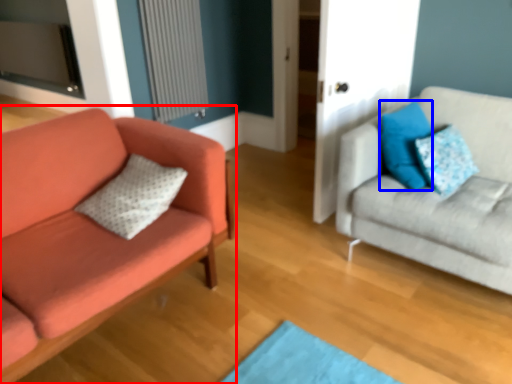
Question: Which object appears closest to the camera in this image, studio couch (highlighted by a red box) or pillow (highlighted by a blue box)?

Choices:
 (A) studio couch
 (B) pillow

Answer: (A)